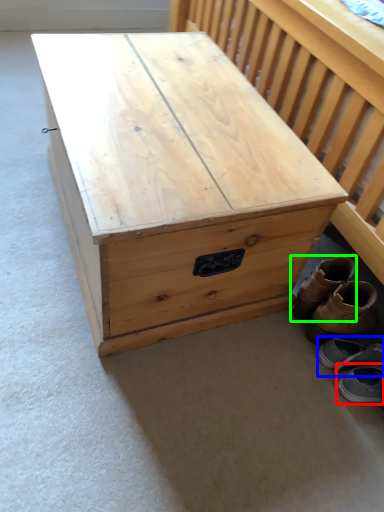
Question: Considering the real-world distances, which object is farthest from footwear (highlighted by a red box)? footwear (highlighted by a blue box) or footwear (highlighted by a green box)?

Choices:
 (A) footwear
 (B) footwear

Answer: (B)